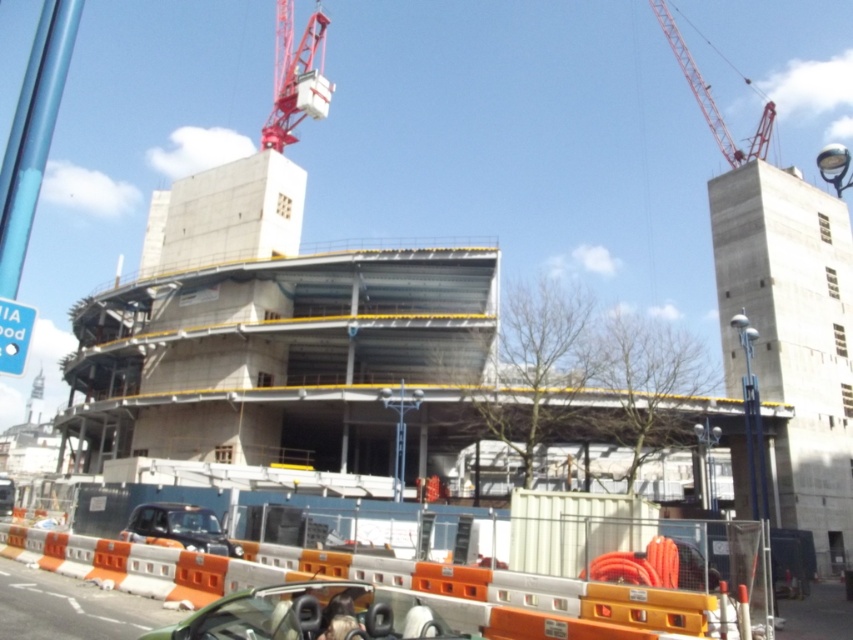
Question: Which object appears closest to the camera in this image?

Choices:
 (A) matte black car at lower center
 (B) green matte convertible at center

Answer: (B)

Question: Which point is closer to the camera?

Choices:
 (A) (669, 44)
 (B) (209, 532)
 (C) (149, 637)
 (D) (302, 42)

Answer: (C)

Question: Is metallic red crane at upper center in front of metallic red crane at upper right?

Choices:
 (A) yes
 (B) no

Answer: (B)

Question: Estimate the real-world distances between objects in this image. Which object is closer to the matte black car at lower center?

Choices:
 (A) green matte convertible at center
 (B) metallic red crane at upper right

Answer: (A)

Question: Does green matte convertible at center have a larger size compared to metallic red crane at upper center?

Choices:
 (A) yes
 (B) no

Answer: (B)

Question: Can you confirm if green matte convertible at center is smaller than matte black car at lower center?

Choices:
 (A) yes
 (B) no

Answer: (A)